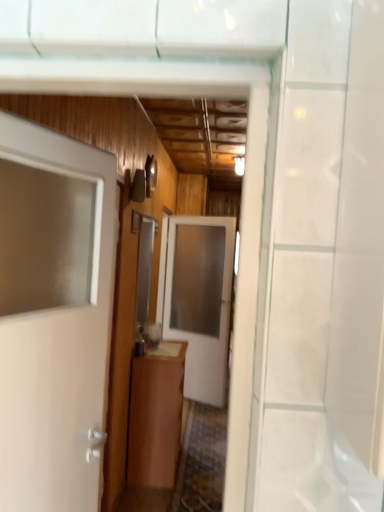
Question: Can you confirm if white glossy door at left, marked as the second door in a back-to-front arrangement, is thinner than brown wood cabinet at center?

Choices:
 (A) yes
 (B) no

Answer: (A)

Question: From the image's perspective, is white glossy door at left, which is the 1th door in front-to-back order, below brown wood cabinet at center?

Choices:
 (A) yes
 (B) no

Answer: (B)

Question: Considering the relative sizes of white glossy door at left, marked as the second door in a back-to-front arrangement, and brown wood cabinet at center in the image provided, is white glossy door at left, marked as the second door in a back-to-front arrangement, taller than brown wood cabinet at center?

Choices:
 (A) yes
 (B) no

Answer: (A)

Question: Does white glossy door at left, marked as the second door in a back-to-front arrangement, come behind brown wood cabinet at center?

Choices:
 (A) no
 (B) yes

Answer: (A)

Question: Is white glossy door at left, marked as the second door in a back-to-front arrangement, oriented away from brown wood cabinet at center?

Choices:
 (A) no
 (B) yes

Answer: (A)

Question: Is white glossy door at left, marked as the second door in a back-to-front arrangement, spatially inside brown wood cabinet at center, or outside of it?

Choices:
 (A) inside
 (B) outside

Answer: (B)

Question: From the image's perspective, is white glossy door at left, marked as the second door in a back-to-front arrangement, positioned above or below brown wood cabinet at center?

Choices:
 (A) above
 (B) below

Answer: (A)

Question: In the image, is white glossy door at left, marked as the second door in a back-to-front arrangement, positioned in front of or behind brown wood cabinet at center?

Choices:
 (A) behind
 (B) front

Answer: (B)

Question: From a real-world perspective, is white glossy door at left, marked as the second door in a back-to-front arrangement, above or below brown wood cabinet at center?

Choices:
 (A) above
 (B) below

Answer: (A)

Question: Is brown wood cabinet at center wider or thinner than white glossy door at left, marked as the second door in a back-to-front arrangement?

Choices:
 (A) thin
 (B) wide

Answer: (B)

Question: Does point (145, 419) appear closer or farther from the camera than point (51, 143)?

Choices:
 (A) farther
 (B) closer

Answer: (A)

Question: From the image's perspective, is brown wood cabinet at center positioned above or below white glossy door at left, which is the 1th door in front-to-back order?

Choices:
 (A) below
 (B) above

Answer: (A)

Question: From their relative heights in the image, would you say brown wood cabinet at center is taller or shorter than white glossy door at left, which is the 1th door in front-to-back order?

Choices:
 (A) tall
 (B) short

Answer: (B)

Question: Based on their positions, is brown wood cabinet at center located to the left or right of white glossy door at center, arranged as the first door when viewed from the back?

Choices:
 (A) right
 (B) left

Answer: (B)

Question: From the image's perspective, relative to white glossy door at center, the 2th door positioned from the front, is brown wood cabinet at center above or below?

Choices:
 (A) below
 (B) above

Answer: (A)